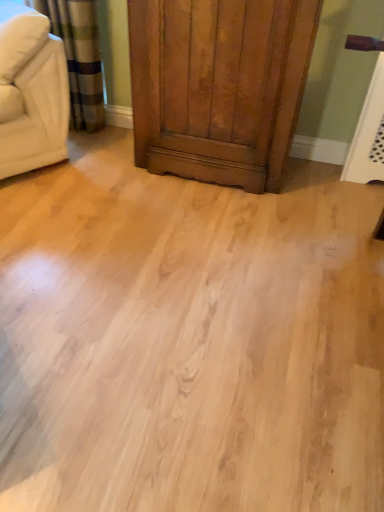
Identify the location of free space above light wood floor at center (from a real-world perspective). The image size is (384, 512). (163, 290).